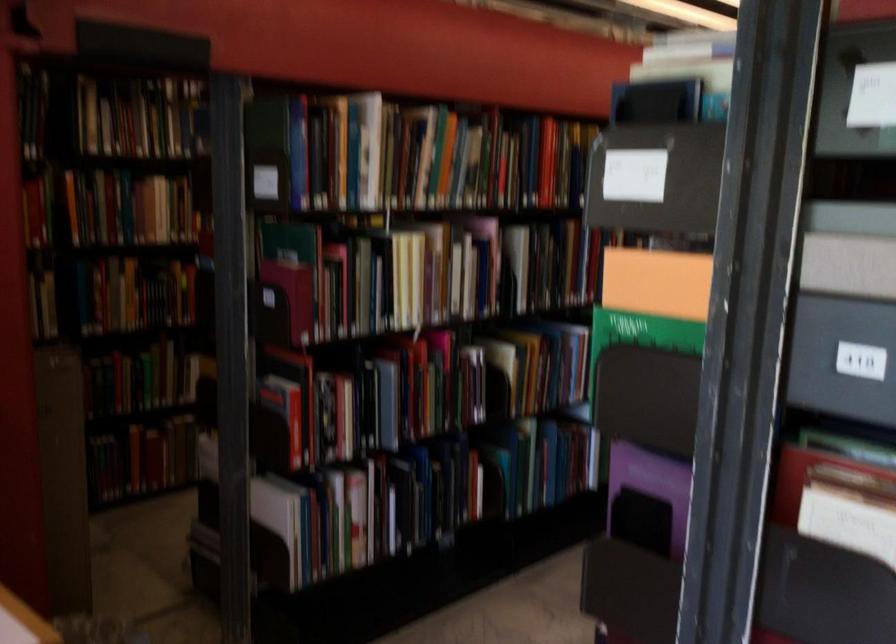
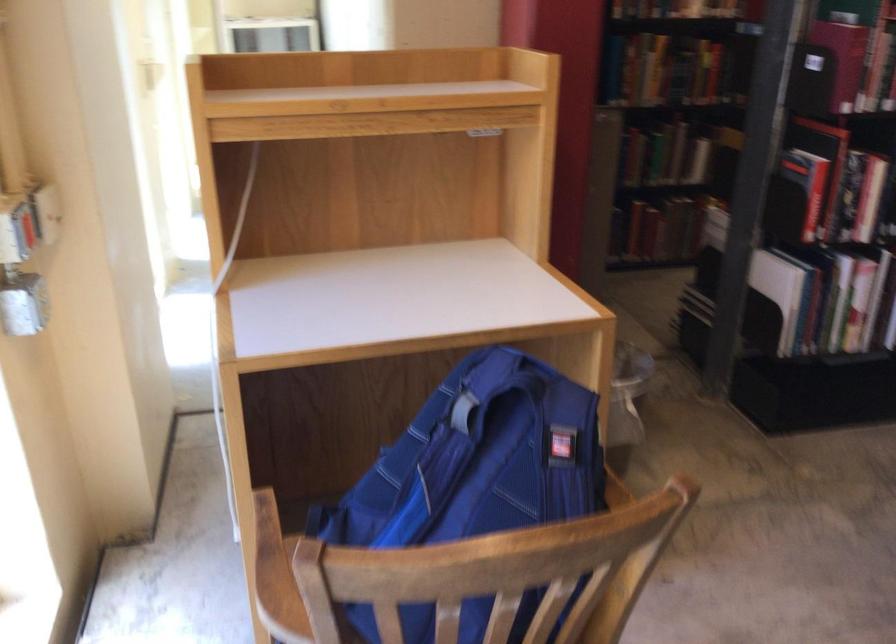
The point at (x=264, y=540) is marked in the first image. Where is the corresponding point in the second image?

(777, 292)